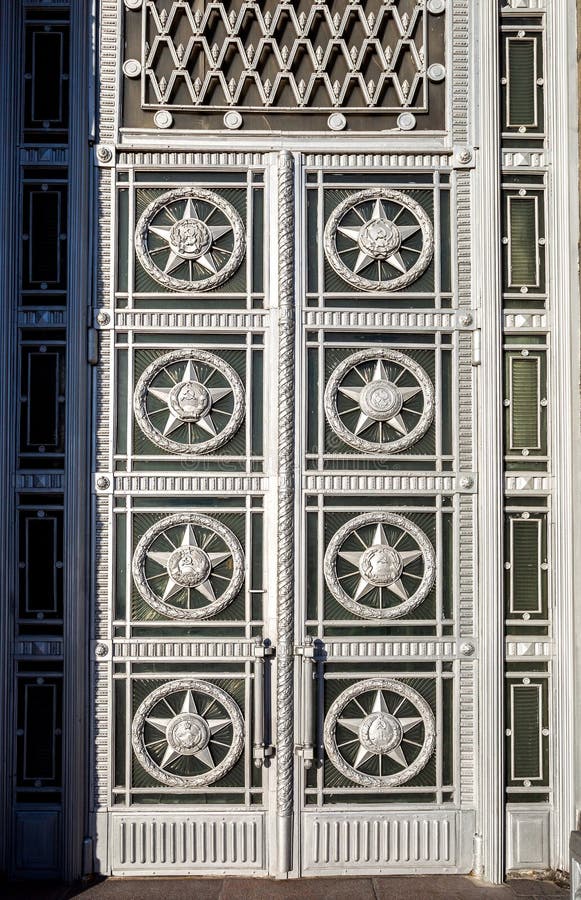
The width and height of the screenshot is (581, 900). Find the location of `bottom right hinge`. bottom right hinge is located at coordinates (479, 856).